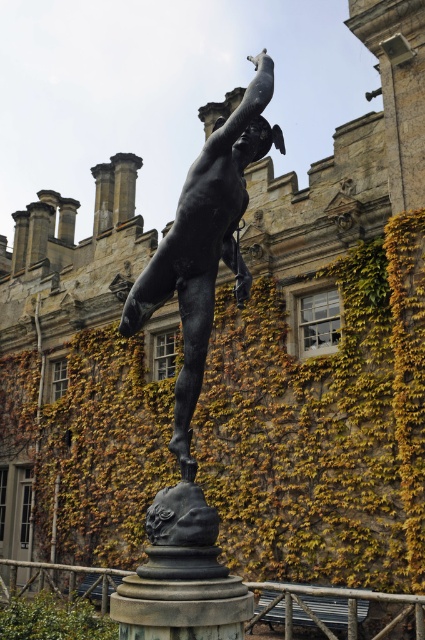
In the scene shown: Which of these two, green ivy at center or bronze statue at center, stands taller?

bronze statue at center is taller.

From the picture: Can you confirm if green ivy at center is positioned above bronze statue at center?

No, green ivy at center is not above bronze statue at center.

Locate an element on the screen. The width and height of the screenshot is (425, 640). green ivy at center is located at coordinates (322, 426).

The height and width of the screenshot is (640, 425). What are the coordinates of `green ivy at center` in the screenshot? It's located at (322, 426).